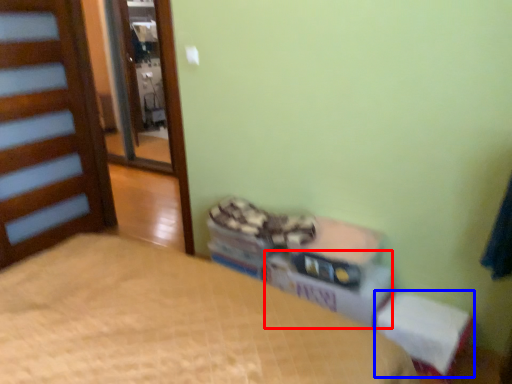
Question: Which object is closer to the camera taking this photo, cardboard box (highlighted by a red box) or changing table (highlighted by a blue box)?

Choices:
 (A) cardboard box
 (B) changing table

Answer: (B)